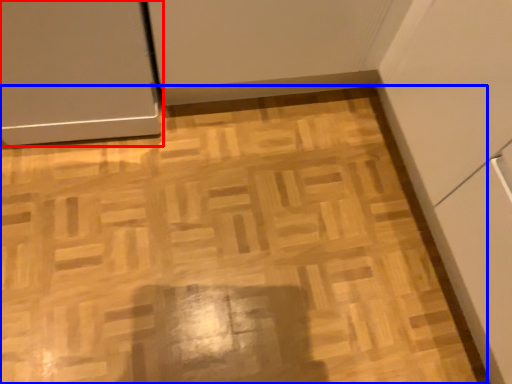
Question: Among these objects, which one is farthest to the camera, door (highlighted by a red box) or plywood (highlighted by a blue box)?

Choices:
 (A) door
 (B) plywood

Answer: (B)